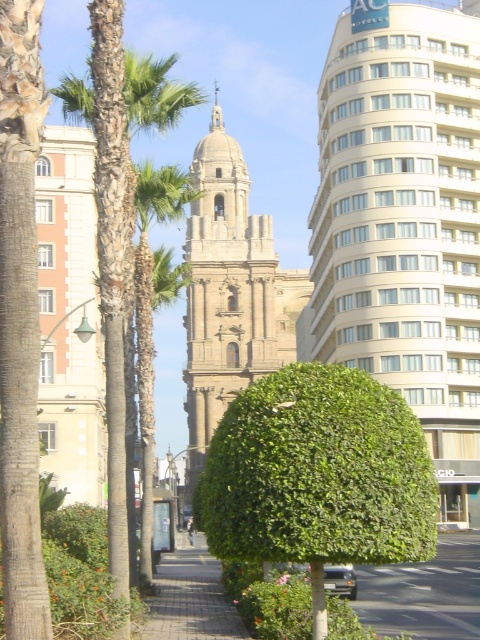
Question: Where is green leafy tree at left located in relation to paved brick sidewalk at center in the image?

Choices:
 (A) below
 (B) above

Answer: (B)

Question: Which point is closer to the camera?

Choices:
 (A) (354, 388)
 (B) (151, 484)
 (C) (191, 368)

Answer: (A)

Question: Based on their relative distances, which object is nearer to the light beige stone bell tower at center?

Choices:
 (A) white glass building at center
 (B) green leafy palm tree at left
 (C) paved brick sidewalk at center
 (D) green leafy tree at left

Answer: (A)

Question: Where is white glass building at center located in relation to green leafy tree at left in the image?

Choices:
 (A) below
 (B) above

Answer: (B)

Question: Is green leafy tree at left smaller than paved brick sidewalk at center?

Choices:
 (A) yes
 (B) no

Answer: (A)

Question: Which object is farther from the camera taking this photo?

Choices:
 (A) green leafy hedge at center
 (B) light beige stone bell tower at center

Answer: (B)